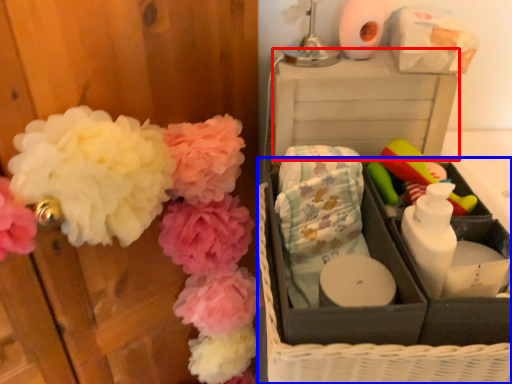
Question: Which object appears closest to the camera in this image, storage box (highlighted by a red box) or basket (highlighted by a blue box)?

Choices:
 (A) storage box
 (B) basket

Answer: (B)